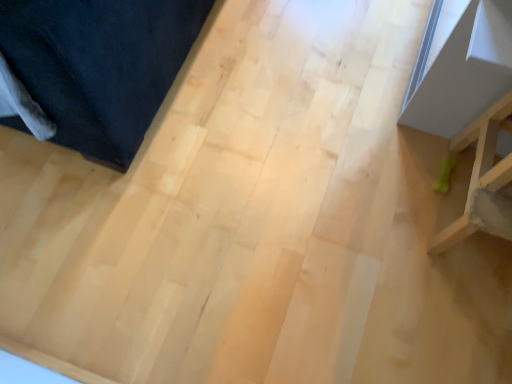
Identify the location of wooden stool at lower right. Image resolution: width=512 pixels, height=384 pixels. (483, 180).

The width and height of the screenshot is (512, 384). Describe the element at coordinates (483, 180) in the screenshot. I see `wooden stool at lower right` at that location.

This screenshot has height=384, width=512. What are the coordinates of `wooden stool at lower right` in the screenshot? It's located at (483, 180).